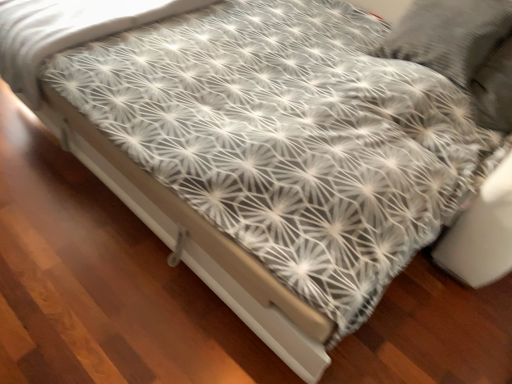
Measure the distance between point (182, 256) and camera.

1.45 meters.

Where is `white matte bed frame at center`? This screenshot has height=384, width=512. white matte bed frame at center is located at coordinates (199, 246).

Describe the element at coordinates (199, 246) in the screenshot. I see `white matte bed frame at center` at that location.

In order to face white textured fabric at center, should I rotate leftwards or rightwards?

You should rotate left by 19.438 degrees.

The width and height of the screenshot is (512, 384). What do you see at coordinates (67, 31) in the screenshot?
I see `white textured fabric at center` at bounding box center [67, 31].

The width and height of the screenshot is (512, 384). I want to click on white textured fabric at center, so click(67, 31).

In order to click on white matte bed frame at center in this screenshot , I will do `click(199, 246)`.

Considering the positions of objects white matte bed frame at center and white textured fabric at center in the image provided, who is more to the right, white matte bed frame at center or white textured fabric at center?

white matte bed frame at center.

In the scene shown: Which is behind, white matte bed frame at center or white textured fabric at center?

white textured fabric at center is behind.

Between point (163, 204) and point (114, 9), which one is positioned in front?

Positioned in front is point (163, 204).

From the image's perspective, between white matte bed frame at center and white textured fabric at center, who is located below?

white matte bed frame at center, from the image's perspective.

From a real-world perspective, relative to white textured fabric at center, is white matte bed frame at center vertically above or below?

white matte bed frame at center is below white textured fabric at center.

Is white matte bed frame at center wider than white textured fabric at center?

Yes.

From their relative heights in the image, would you say white matte bed frame at center is taller or shorter than white textured fabric at center?

white matte bed frame at center is shorter than white textured fabric at center.

Who is smaller, white matte bed frame at center or white textured fabric at center?

white matte bed frame at center.

Would you say white matte bed frame at center is outside white textured fabric at center?

Yes.

Is white matte bed frame at center touching white textured fabric at center?

white matte bed frame at center is not next to white textured fabric at center, and they're not touching.

Is white matte bed frame at center oriented away from white textured fabric at center?

No, white matte bed frame at center is not facing the opposite direction of white textured fabric at center.

Find the location of a particular element. The image size is (512, 384). bed frame lying in front of the white textured fabric at center is located at coordinates pos(199,246).

Which object is positioned more to the right, white textured fabric at center or white matte bed frame at center?

white matte bed frame at center.

In the image, is white textured fabric at center positioned in front of or behind white matte bed frame at center?

white textured fabric at center is positioned farther from the viewer than white matte bed frame at center.

Considering the positions of points (95, 29) and (208, 230), is point (95, 29) closer to camera compared to point (208, 230)?

No, it is behind (208, 230).

From the image's perspective, is white textured fabric at center located beneath white matte bed frame at center?

No, from the image's perspective, white textured fabric at center is not beneath white matte bed frame at center.

From a real-world perspective, which object rests below the other?

In real-world perspective, white matte bed frame at center is lower.

Considering the sizes of white textured fabric at center and white matte bed frame at center in the image, is white textured fabric at center wider or thinner than white matte bed frame at center?

In the image, white textured fabric at center appears to be more narrow than white matte bed frame at center.

Considering the sizes of objects white textured fabric at center and white matte bed frame at center in the image provided, who is taller, white textured fabric at center or white matte bed frame at center?

Standing taller between the two is white textured fabric at center.

Can you confirm if white textured fabric at center is bigger than white matte bed frame at center?

Yes, white textured fabric at center is bigger than white matte bed frame at center.

Is white textured fabric at center surrounding white matte bed frame at center?

No, white matte bed frame at center is not inside white textured fabric at center.

Is white textured fabric at center beside white matte bed frame at center?

No, white textured fabric at center is not in contact with white matte bed frame at center.

Does white textured fabric at center turn towards white matte bed frame at center?

No, white textured fabric at center is not aimed at white matte bed frame at center.

What's the angular difference between white textured fabric at center and white matte bed frame at center's facing directions?

The facing directions of white textured fabric at center and white matte bed frame at center are 91.2 degrees apart.

Locate an element on the screen. This screenshot has width=512, height=384. sheet located behind the white matte bed frame at center is located at coordinates (67, 31).

You are a GUI agent. You are given a task and a screenshot of the screen. Output one action in this format:
    pyautogui.click(x=<x>, y=<y>)
    Task: Click on the bed frame that appears below the white textured fabric at center (from the image's perspective)
    The width and height of the screenshot is (512, 384).
    Given the screenshot: What is the action you would take?
    pyautogui.click(x=199, y=246)

Locate an element on the screen. sheet behind the white matte bed frame at center is located at coordinates (67, 31).